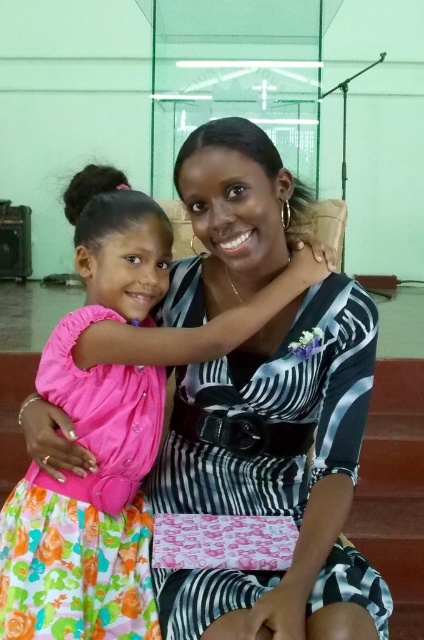
What is the color and material of the dress located at point (147, 301)?

The pink satin dress at center is located at point (147, 301).

You are organizing a fashion show and need to arrange two pink satin dresses. The pink satin dress at center and the pink satin dress at left must be displayed side by side. Which dress should be placed on the left side to ensure they fit within a 2.5 meter wide display area?

The pink satin dress at left should be placed on the left side because its width is smaller than the pink satin dress at center, allowing both dresses to fit within the 2.5 meter display area when arranged side by side.

You are a photographer setting up for an event in this room. You need to place two pink satin dresses, one at the center and one at the left, for a photoshoot. The dresses must be spaced exactly 4.30 centimeters apart. Given that the room has limited space, can you confirm if the current distance between the pink satin dress at center and pink satin dress at left meets the requirement?

Yes, the pink satin dress at center and pink satin dress at left are already 4.30 centimeters apart, which matches the required spacing for the photoshoot.